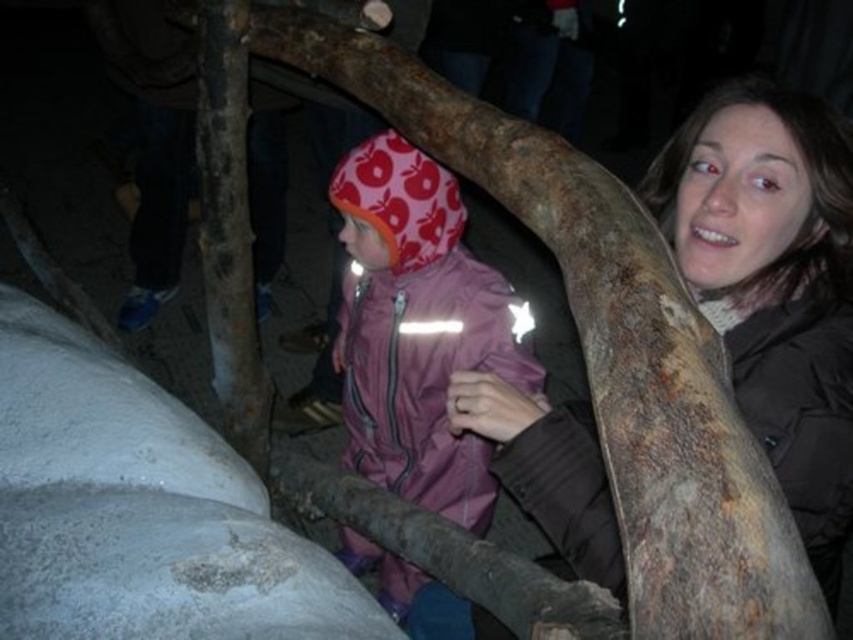
Between pink fabric jacket at center and rusty wood tree trunk at center, which one appears on the left side from the viewer's perspective?

Positioned to the left is rusty wood tree trunk at center.

Where is `pink fabric jacket at center`? pink fabric jacket at center is located at coordinates (416, 330).

Which is more to the left, matte brown jacket at right or rusty wood tree trunk at center?

Positioned to the left is rusty wood tree trunk at center.

Is matte brown jacket at right shorter than rusty wood tree trunk at center?

Correct, matte brown jacket at right is not as tall as rusty wood tree trunk at center.

Is point (776, 300) positioned after point (230, 74)?

No, (776, 300) is closer to viewer.

The image size is (853, 640). I want to click on matte brown jacket at right, so click(775, 284).

Does matte brown jacket at right lie in front of pink fabric jacket at center?

Yes, matte brown jacket at right is in front of pink fabric jacket at center.

Is point (508, 404) positioned in front of point (369, 188)?

Yes, point (508, 404) is closer to viewer.

Where is `matte brown jacket at right`? matte brown jacket at right is located at coordinates (775, 284).